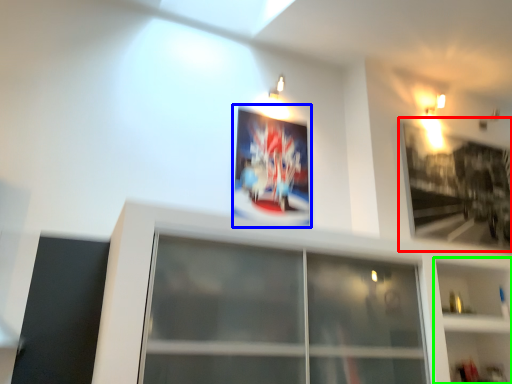
Question: Based on their relative distances, which object is farther from picture frame (highlighted by a red box)? Choose from picture frame (highlighted by a blue box) and shelf (highlighted by a green box).

Choices:
 (A) picture frame
 (B) shelf

Answer: (A)